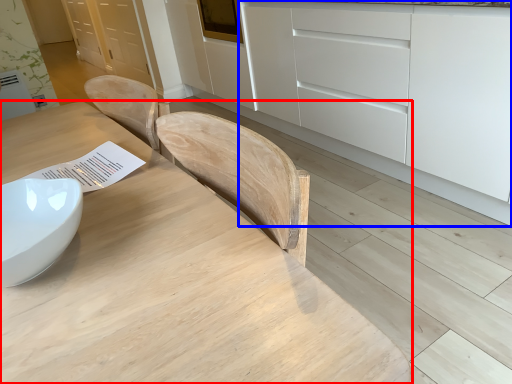
Question: Among these objects, which one is nearest to the camera, table (highlighted by a red box) or cabinetry (highlighted by a blue box)?

Choices:
 (A) table
 (B) cabinetry

Answer: (A)